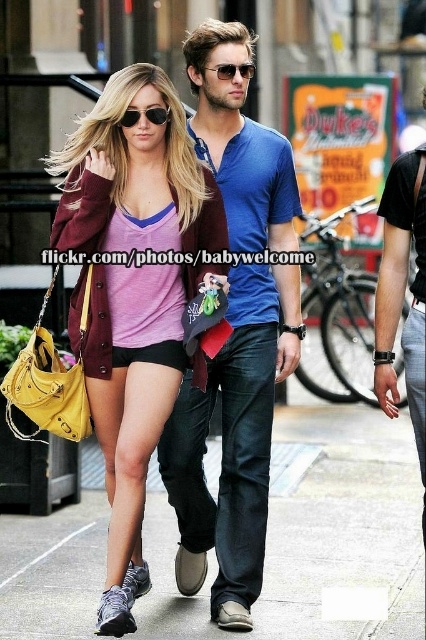
Can you confirm if matte purple shirt at center is smaller than sunglasses at center?

No, matte purple shirt at center is not smaller than sunglasses at center.

Who is higher up, matte purple shirt at center or sunglasses at center?

sunglasses at center

Between point (131, 561) and point (229, 67), which one is positioned in front?

Point (131, 561)

Identify the location of matte purple shirt at center. (134, 401).

Can you confirm if gray concrete pavement at lower center is shorter than matte black sunglasses at upper center?

Incorrect, gray concrete pavement at lower center's height does not fall short of matte black sunglasses at upper center's.

Does point (81, 621) come farther from viewer compared to point (146, 113)?

No.

This screenshot has width=426, height=640. Identify the location of gray concrete pavement at lower center. (316, 540).

Is matte purple shirt at center bigger than matte black sunglasses at upper center?

Yes.

Does point (106, 310) come farther from viewer compared to point (155, 118)?

No.

Is point (118, 221) closer to camera compared to point (129, 115)?

No, it is behind (129, 115).

You are a GUI agent. You are given a task and a screenshot of the screen. Output one action in this format:
    pyautogui.click(x=<x>, y=<y>)
    Task: Click on the matte purple shirt at center
    The image size is (426, 640).
    Given the screenshot: What is the action you would take?
    pyautogui.click(x=134, y=401)